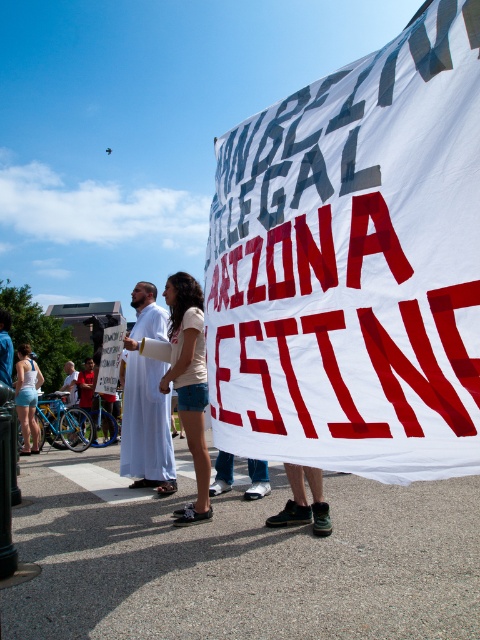
You are a photographer standing at the crosswalk in the scene. You want to take a photo that includes both the matte white shirt at center and the matte white tank top at lower left. Given that your camera has a maximum focus range of 15 feet, will you be able to capture both subjects clearly in the same frame?

The distance between the matte white shirt at center and the matte white tank top at lower left is 16.90 feet. Since your camera can only focus up to 15 feet, you won t be able to capture both subjects clearly in the same frame.

You are a photographer trying to capture the protest scene. You notice two points in the image at coordinates point [325,340] and point [33,404]. Which point is positioned closer to your camera lens?

Point [325,340] is closer to the camera than point [33,404].

You are a photographer trying to capture a clear shot of the white fabric banner at center and the matte white shirt at center. Which object will appear larger in your photo?

The white fabric banner at center will appear larger in the photo because it is closer to the viewer than the matte white shirt at center.